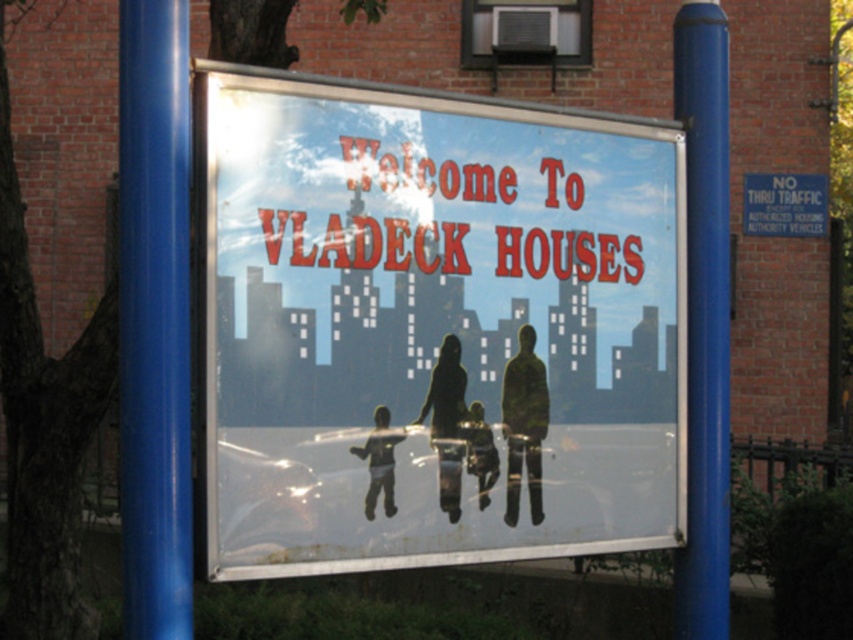
You are standing in front of the signboard at VLADECK HOUSES. You want to take a photo of the dark matte figure at center so that it fills the frame. Given that your camera has a minimum focusing distance of 3 meters, will you need to step back or move closer?

The dark matte figure at center is 4.23 meters away from the camera. Since your camera can focus as close as 3 meters, you can move closer to the dark matte figure at center to fill the frame without exceeding the minimum focusing distance.

You are a delivery person with a cart that is 3 meters wide. You need to pass between the two blue posts to deliver packages to VLADECK HOUSES. Can your cart fit through the space between the blue glossy pole at center and the other blue post?

The two blue posts are 3.79 meters apart, so yes, the cart that is 3 meters wide can fit through the space between the blue glossy pole at center and the other blue post since the distance is wider than the cart.